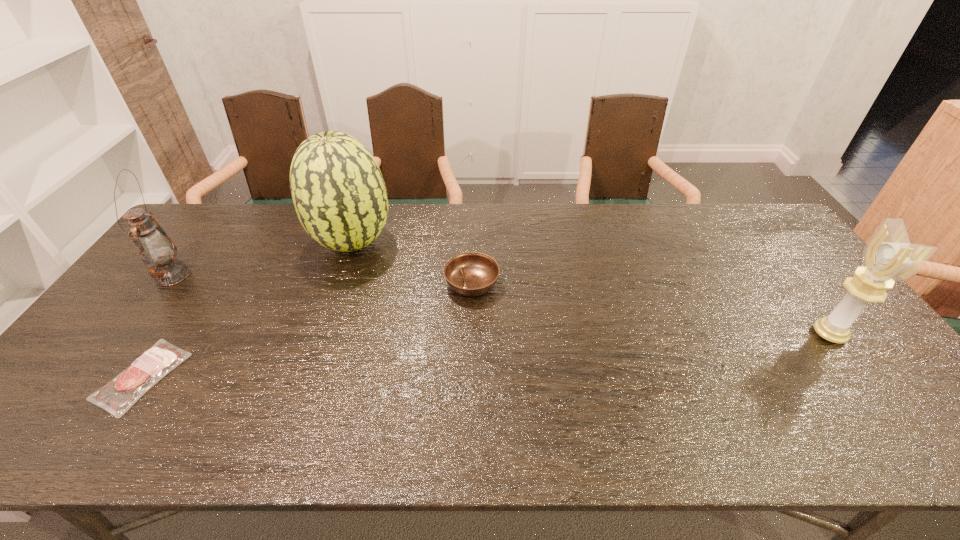
This screenshot has height=540, width=960. Identify the location of watermelon. (339, 194).

Find the location of a particular element. oil lamp is located at coordinates coord(153,244).

You are a GUI agent. You are given a task and a screenshot of the screen. Output one action in this format:
    pyautogui.click(x=<x>, y=<y>)
    Task: Click on the rightmost object
    This screenshot has height=540, width=960.
    Given the screenshot: What is the action you would take?
    pyautogui.click(x=888, y=256)

Where is `soup bowl`? This screenshot has height=540, width=960. soup bowl is located at coordinates (470, 274).

Image resolution: width=960 pixels, height=540 pixels. What are the coordinates of `the fourth tallest object` in the screenshot? It's located at (470, 274).

The image size is (960, 540). Identify the location of the shortest object. 120,394.

The width and height of the screenshot is (960, 540). I want to click on vacant space located on the right of the third object from right to left, so click(485, 242).

Where is `vacant space located on the back of the oil lamp`? The width and height of the screenshot is (960, 540). vacant space located on the back of the oil lamp is located at coordinates (220, 212).

Identify the location of vacant space situated 0.060m on the front-facing side of the rightmost object. (791, 334).

I want to click on free space located 0.140m on the front-facing side of the rightmost object, so click(x=760, y=334).